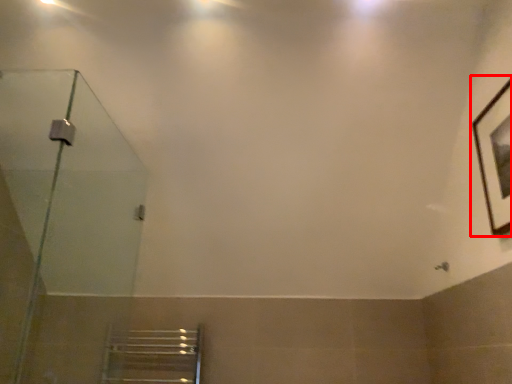
Question: From the image, what is the correct spatial relationship of picture frame (annotated by the red box) in relation to shower door?

Choices:
 (A) left
 (B) right

Answer: (B)